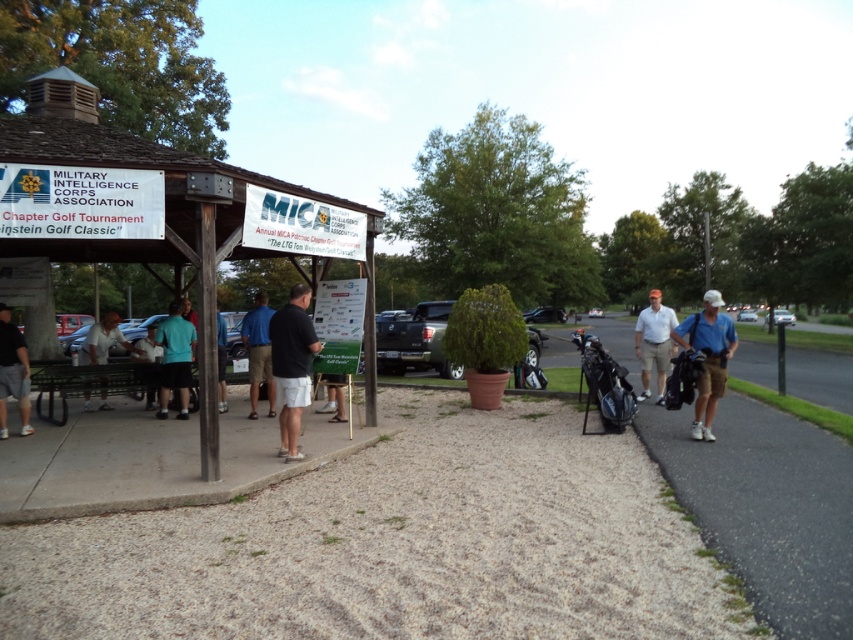
Question: Is wooden gazebo at center bigger than black shirt at center?

Choices:
 (A) no
 (B) yes

Answer: (B)

Question: Which point is farther to the camera?

Choices:
 (A) (271, 417)
 (B) (265, 467)

Answer: (A)

Question: Which point is farther to the camera?

Choices:
 (A) (160, 360)
 (B) (44, 228)

Answer: (A)

Question: Can you confirm if blue shirt at center is thinner than light blue shirt at center?

Choices:
 (A) yes
 (B) no

Answer: (A)

Question: Which of the following is the farthest from the observer?

Choices:
 (A) (709, 292)
 (B) (144, 408)

Answer: (B)

Question: Does black matte shirt at center have a smaller size compared to teal matte shirt at center?

Choices:
 (A) no
 (B) yes

Answer: (B)